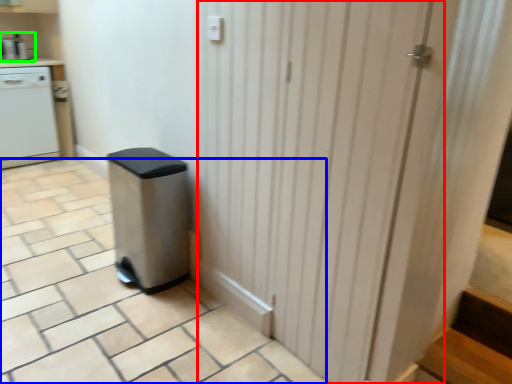
Question: Which object is positioned closest to screen door (highlighted by a red box)? Select from tile (highlighted by a blue box) and kitchen appliance (highlighted by a green box).

Choices:
 (A) tile
 (B) kitchen appliance

Answer: (A)